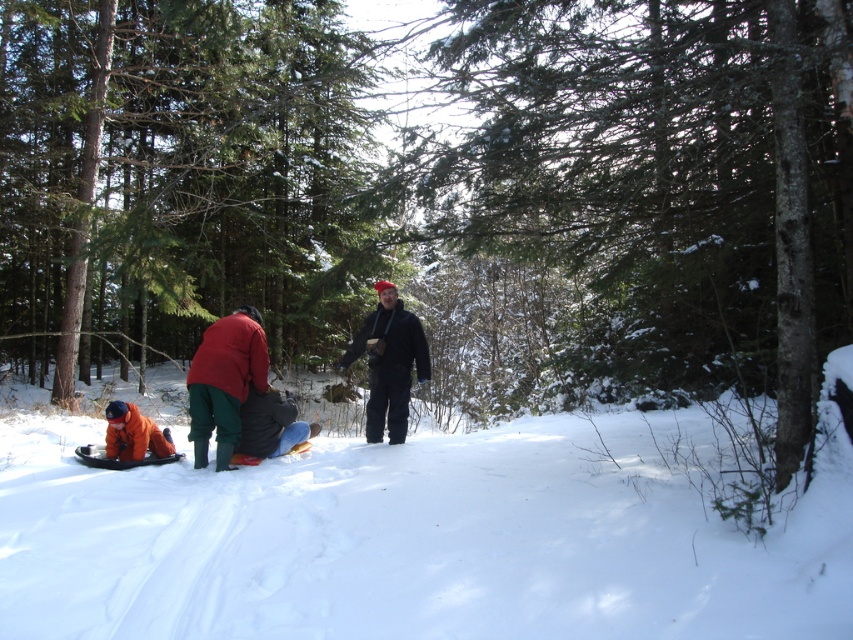
Question: Which of these objects is positioned farthest from the white fluffy snow at center?

Choices:
 (A) matte black jacket at center
 (B) matte red jacket at center
 (C) denim pants at center

Answer: (B)

Question: Which object is positioned farthest from the orange fleece jacket at lower left?

Choices:
 (A) matte red jacket at center
 (B) denim pants at center
 (C) white fluffy snow at center
 (D) matte black jacket at center

Answer: (C)

Question: In this image, where is white fluffy snow at center located relative to orange fleece jacket at lower left?

Choices:
 (A) left
 (B) right

Answer: (B)

Question: Does matte black jacket at center appear on the right side of denim pants at center?

Choices:
 (A) no
 (B) yes

Answer: (B)

Question: Which point is farther to the camera?

Choices:
 (A) orange fabric snowshoe at lower left
 (B) matte black jacket at center

Answer: (B)

Question: Can you confirm if matte red jacket at center is smaller than orange fabric snowshoe at lower left?

Choices:
 (A) no
 (B) yes

Answer: (A)